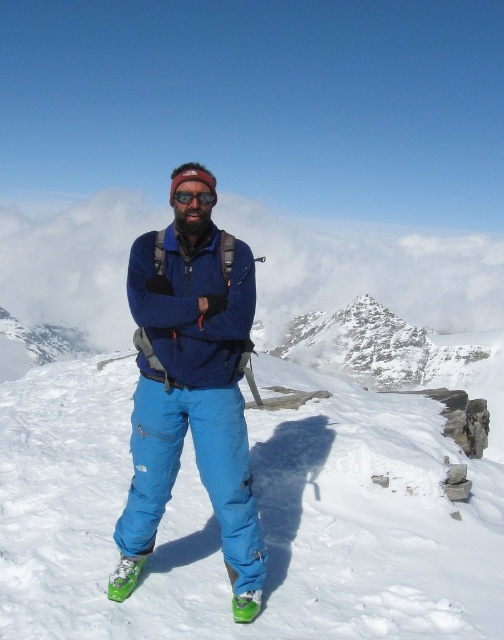
You are planning to take a photo of the blue fabric ski slope at center and the white fluffy cloud at upper center. Which object should you focus on first if you want to capture both in a single shot without moving the camera?

You should focus on the blue fabric ski slope at center first because it is below the white fluffy cloud at upper center, so adjusting the focus from the lower to the upper part of the frame will help capture both in one shot.

You are a photographer planning to take a photo of the person in the scene. Since the blue fabric ski slope at center and the blue fabric pants at center are both blue, how can you ensure that the ski slope and the pants are distinguishable in the final image?

The blue fabric ski slope at center is positioned under the blue fabric pants at center, so adjusting the camera angle to capture the pants above the ski slope will help distinguish them based on their vertical placement.

Based on the scene description, what object is located at the coordinates point [260,513]?

The blue fabric ski slope at center is located at point [260,513].